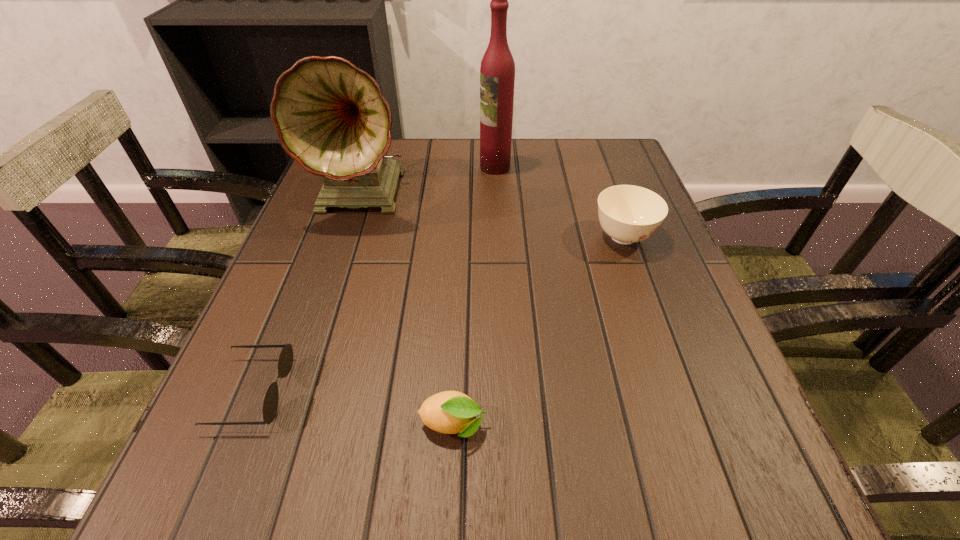
The width and height of the screenshot is (960, 540). In order to click on vacant position in the image that satisfies the following two spatial constraints: 1. from the horn of the record player; 2. on the right side of the third shortest object in this screenshot , I will do `click(352, 237)`.

This screenshot has height=540, width=960. Find the location of `free point that satisfies the following two spatial constraints: 1. on the front side of the sugar bowl; 2. on the front-facing side of the sunglasses`. free point that satisfies the following two spatial constraints: 1. on the front side of the sugar bowl; 2. on the front-facing side of the sunglasses is located at coordinates (679, 392).

I want to click on vacant region that satisfies the following two spatial constraints: 1. on the front side of the third shortest object; 2. on the front-facing side of the sunglasses, so click(679, 392).

Locate an element on the screen. This screenshot has width=960, height=540. free space that satisfies the following two spatial constraints: 1. on the label of the rightmost object; 2. on the left side of the liquor is located at coordinates (498, 237).